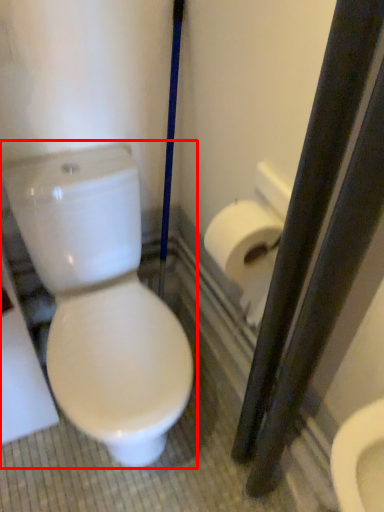
Question: From the image's perspective, what is the correct spatial positioning of toilet (annotated by the red box) in reference to toilet paper?

Choices:
 (A) above
 (B) below

Answer: (B)